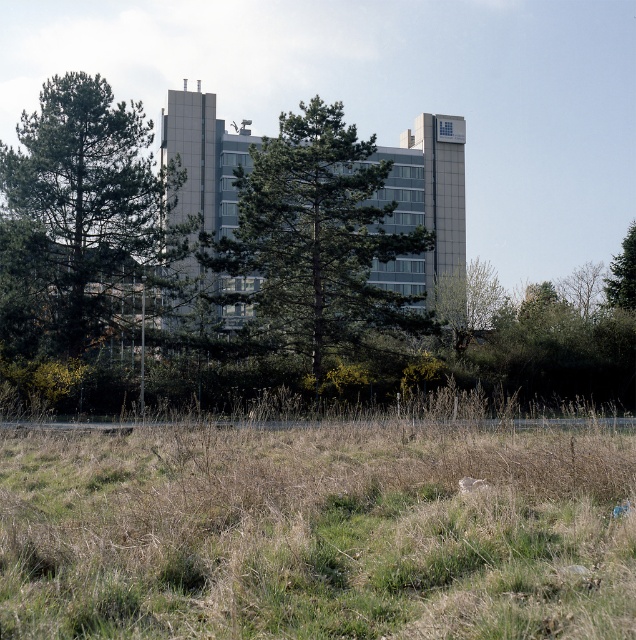
What do you see at coordinates (83, 220) in the screenshot? This screenshot has height=640, width=636. I see `green matte tree at center` at bounding box center [83, 220].

Between green matte tree at center and green leafy tree at upper right, which one is positioned higher?

green matte tree at center is higher up.

What do you see at coordinates (83, 220) in the screenshot? This screenshot has width=636, height=640. I see `green matte tree at center` at bounding box center [83, 220].

In order to click on green matte tree at center in this screenshot , I will do `click(83, 220)`.

Between green matte tree at center and green leafy tree at center, which one appears on the right side from the viewer's perspective?

green leafy tree at center

Does green matte tree at center have a larger size compared to green leafy tree at center?

No, green matte tree at center is not bigger than green leafy tree at center.

Is point (156, 264) closer to viewer compared to point (251, 243)?

That is False.

This screenshot has height=640, width=636. I want to click on green matte tree at center, so pos(83,220).

Is green grass at lower center positioned in front of green leafy tree at center?

That is True.

Identify the location of green grass at lower center. (315, 532).

Does point (99, 557) come farther from viewer compared to point (286, 339)?

No.

Where is `green grass at lower center`? The image size is (636, 640). green grass at lower center is located at coordinates (315, 532).